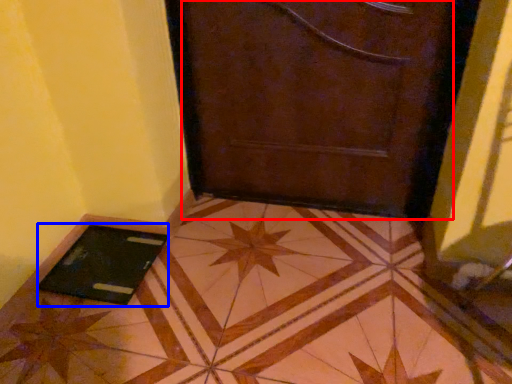
Question: Among these objects, which one is farthest to the camera, door (highlighted by a red box) or tablet computer (highlighted by a blue box)?

Choices:
 (A) door
 (B) tablet computer

Answer: (B)